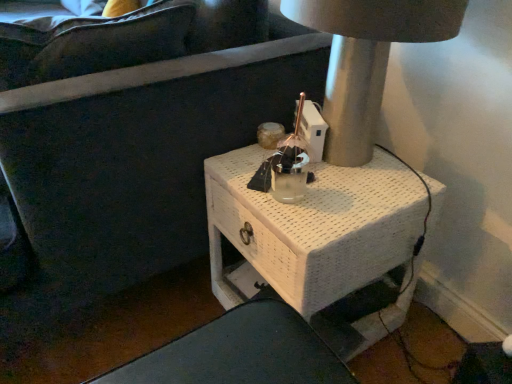
Question: Is there a large distance between white woven table at center and matte gray table lamp at upper right?

Choices:
 (A) yes
 (B) no

Answer: (B)

Question: Is the depth of white woven table at center less than that of matte gray table lamp at upper right?

Choices:
 (A) no
 (B) yes

Answer: (A)

Question: Is white woven table at center wider than matte gray table lamp at upper right?

Choices:
 (A) no
 (B) yes

Answer: (B)

Question: From a real-world perspective, does white woven table at center sit lower than matte gray table lamp at upper right?

Choices:
 (A) no
 (B) yes

Answer: (B)

Question: From the image's perspective, is white woven table at center above matte gray table lamp at upper right?

Choices:
 (A) no
 (B) yes

Answer: (A)

Question: Does white woven table at center have a lesser width compared to matte gray table lamp at upper right?

Choices:
 (A) yes
 (B) no

Answer: (B)

Question: Can you confirm if matte gray table lamp at upper right is thinner than white woven table at center?

Choices:
 (A) yes
 (B) no

Answer: (A)

Question: From the image's perspective, is matte gray table lamp at upper right below white woven table at center?

Choices:
 (A) no
 (B) yes

Answer: (A)

Question: Would you consider matte gray table lamp at upper right to be distant from white woven table at center?

Choices:
 (A) no
 (B) yes

Answer: (A)

Question: Would you say matte gray table lamp at upper right is outside white woven table at center?

Choices:
 (A) yes
 (B) no

Answer: (A)

Question: Does matte gray table lamp at upper right turn towards white woven table at center?

Choices:
 (A) yes
 (B) no

Answer: (B)

Question: Is matte gray table lamp at upper right looking in the opposite direction of white woven table at center?

Choices:
 (A) yes
 (B) no

Answer: (B)

Question: Is matte gray table lamp at upper right to the left or to the right of white woven table at center in the image?

Choices:
 (A) left
 (B) right

Answer: (B)